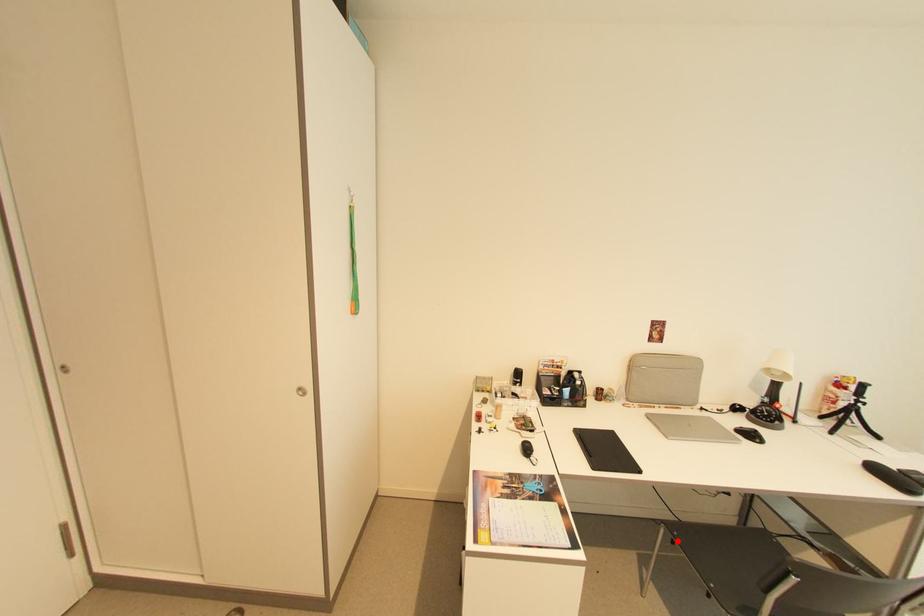
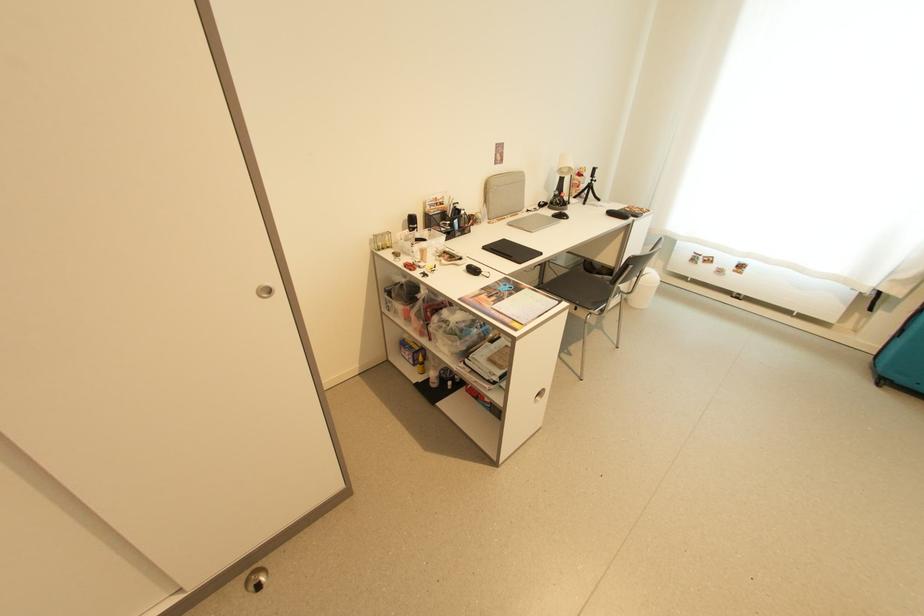
Question: I am providing you with two images of the same scene from different viewpoints. In image1, a red point is highlighted. Considering the same 3D point in image2, which of the following is correct?

Choices:
 (A) It is closer
 (B) It is farther

Answer: (B)